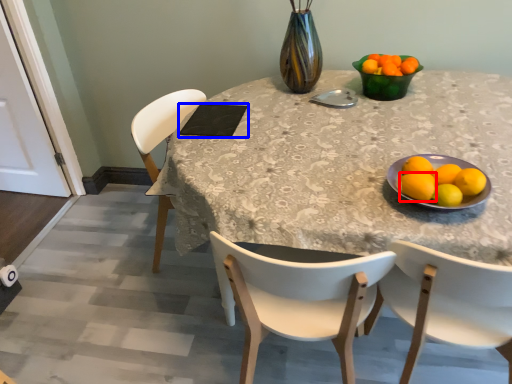
Question: Which point is further to the camera, lemon (highlighted by a red box) or pad (highlighted by a blue box)?

Choices:
 (A) lemon
 (B) pad

Answer: (B)